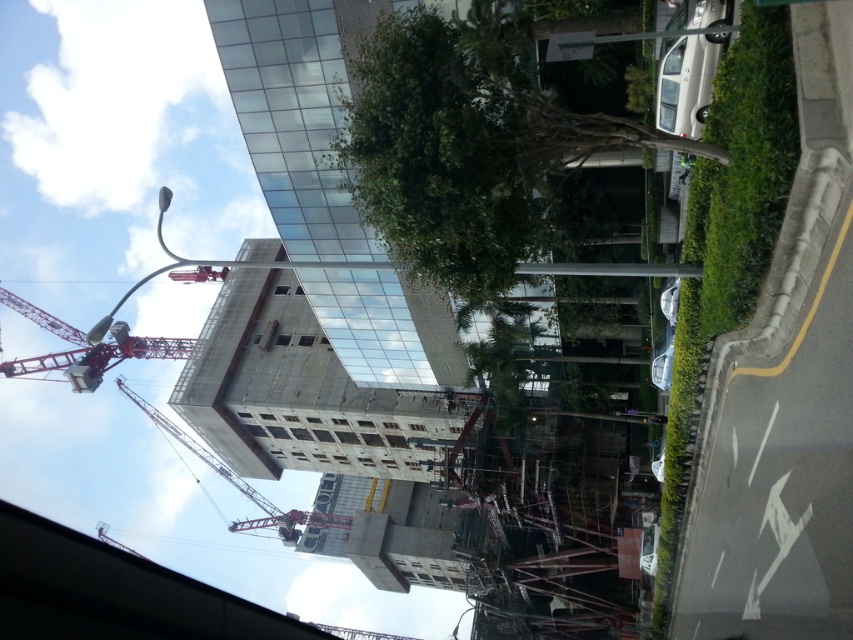
Which is more to the right, green leafy tree at upper center or red metallic crane at upper left?

green leafy tree at upper center

Is green leafy tree at upper center thinner than red metallic crane at upper left?

Yes, green leafy tree at upper center is thinner than red metallic crane at upper left.

Find the location of a particular element. This screenshot has height=640, width=853. green leafy tree at upper center is located at coordinates (440, 148).

Does green leafy tree at upper center have a greater width compared to red metal crane at center?

No.

Can you confirm if green leafy tree at upper center is shorter than red metal crane at center?

Yes, green leafy tree at upper center is shorter than red metal crane at center.

Does point (447, 24) come farther from viewer compared to point (236, 483)?

No, it is not.

The height and width of the screenshot is (640, 853). In order to click on green leafy tree at upper center in this screenshot , I will do `click(440, 148)`.

Which is above, red metallic crane at upper left or red metal crane at center?

red metallic crane at upper left is above.

Which is in front, point (177, 342) or point (144, 412)?

Point (177, 342)

Does point (54, 358) come behind point (125, 387)?

That is True.

Locate an element on the screen. This screenshot has height=640, width=853. red metallic crane at upper left is located at coordinates (86, 348).